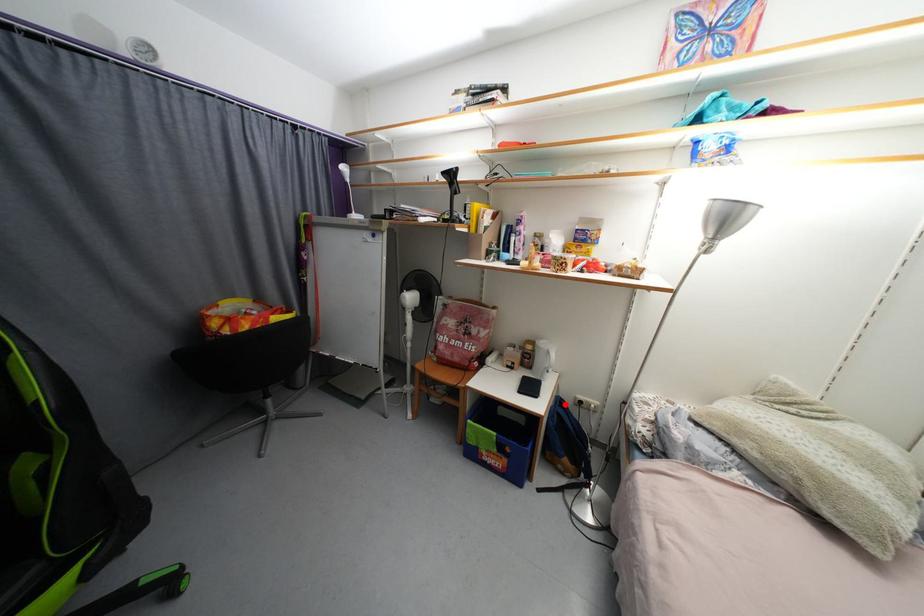
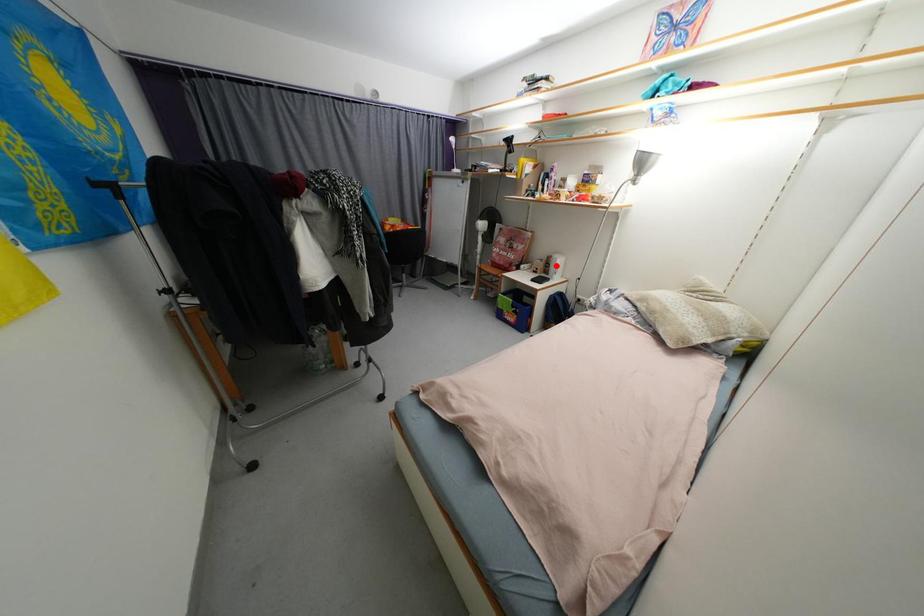
I am providing you with two images of the same scene from different viewpoints. A red point is marked on the first image and another point is marked on the second image. Is the marked point in image1 the same physical position as the marked point in image2?

No